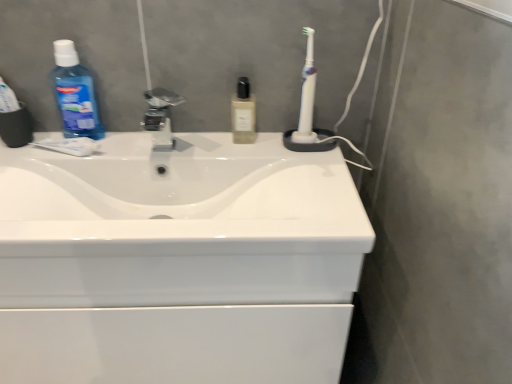
Question: Does blue translucent mouthwash at left have a smaller size compared to white plastic toothbrush at upper right?

Choices:
 (A) yes
 (B) no

Answer: (B)

Question: Does blue translucent mouthwash at left have a greater width compared to white plastic toothbrush at upper right?

Choices:
 (A) yes
 (B) no

Answer: (A)

Question: Does blue translucent mouthwash at left contain white plastic toothbrush at upper right?

Choices:
 (A) yes
 (B) no

Answer: (B)

Question: Is blue translucent mouthwash at left not close to white plastic toothbrush at upper right?

Choices:
 (A) yes
 (B) no

Answer: (B)

Question: Does blue translucent mouthwash at left have a lesser width compared to white plastic toothbrush at upper right?

Choices:
 (A) yes
 (B) no

Answer: (B)

Question: Would you say blue translucent mouthwash at left is outside white plastic toothbrush at upper right?

Choices:
 (A) yes
 (B) no

Answer: (A)

Question: Would you say blue translucent mouthwash at left contains white glossy sink at center?

Choices:
 (A) no
 (B) yes

Answer: (A)

Question: From the image's perspective, is blue translucent mouthwash at left located beneath white glossy sink at center?

Choices:
 (A) no
 (B) yes

Answer: (A)

Question: Is the position of blue translucent mouthwash at left less distant than that of white glossy sink at center?

Choices:
 (A) no
 (B) yes

Answer: (A)

Question: Is blue translucent mouthwash at left to the left of white glossy sink at center from the viewer's perspective?

Choices:
 (A) yes
 (B) no

Answer: (A)

Question: Considering the relative positions of blue translucent mouthwash at left and white glossy sink at center in the image provided, is blue translucent mouthwash at left behind white glossy sink at center?

Choices:
 (A) yes
 (B) no

Answer: (A)

Question: From a real-world perspective, is blue translucent mouthwash at left physically above white glossy sink at center?

Choices:
 (A) no
 (B) yes

Answer: (B)

Question: Is the position of blue translucent mouthwash at left more distant than that of translucent glass bottle at center?

Choices:
 (A) yes
 (B) no

Answer: (B)